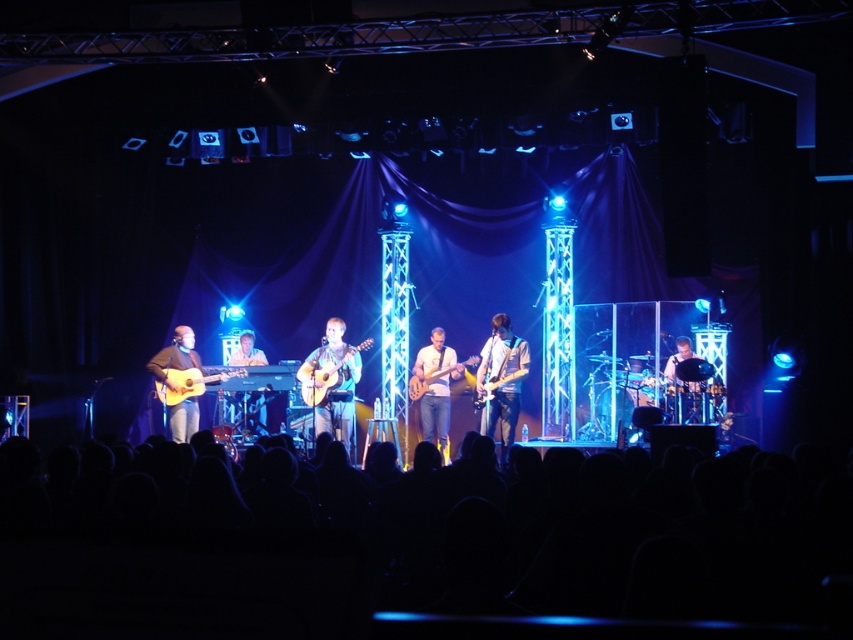
Question: Which point is closer to the camera?

Choices:
 (A) black drum at center
 (B) glossy electric guitar at center

Answer: (A)

Question: Is light brown wood guitar at center smaller than matte brown keyboard at center?

Choices:
 (A) no
 (B) yes

Answer: (A)

Question: Does shiny silver guitar at center appear under matte brown acoustic guitar at left?

Choices:
 (A) yes
 (B) no

Answer: (A)

Question: Which point appears closest to the camera in this image?

Choices:
 (A) (172, 339)
 (B) (492, 516)

Answer: (B)

Question: Can you confirm if black fabric crowd at lower center is positioned to the left of acoustic wood guitar at center?

Choices:
 (A) yes
 (B) no

Answer: (B)

Question: Which of the following is the farthest from the observer?

Choices:
 (A) matte brown acoustic guitar at left
 (B) light brown wood guitar at center
 (C) black drum at center

Answer: (A)